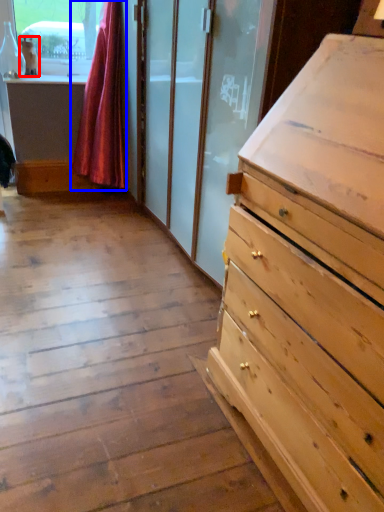
Question: Which of the following is the closest to the observer, animal (highlighted by a red box) or curtain (highlighted by a blue box)?

Choices:
 (A) animal
 (B) curtain

Answer: (B)